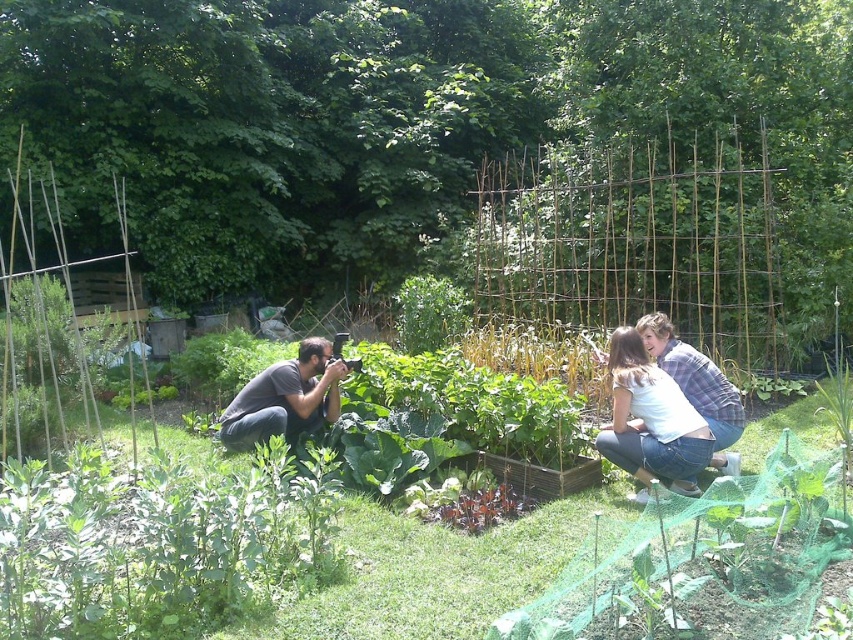
You are organizing a garden tour and need to ensure there is enough space for visitors to walk between the two people wearing the matte gray shirt at lower left and the white cotton shirt at center. Based on their size, do you think the path between them will be wide enough for a visitor to pass comfortably?

The matte gray shirt at lower left occupies less space than the white cotton shirt at center, so the path between them may be narrower near the matte gray shirt at lower left. Visitors should still be able to pass, but there might be less space available compared to the area near the white cotton shirt at center.